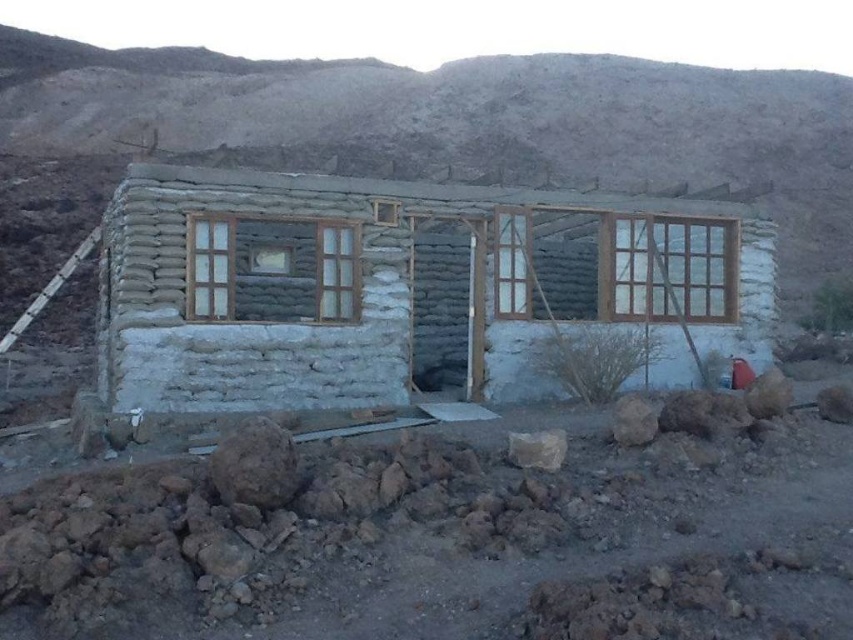
Question: Is wooden-framed glass window at center-right thinner than clear glass door at center?

Choices:
 (A) yes
 (B) no

Answer: (B)

Question: Estimate the real-world distances between objects in this image. Which object is farther from the brown rough rock at lower left?

Choices:
 (A) smooth gray rock at lower center
 (B) gray stone house at center
 (C) wooden-framed glass window at center-right

Answer: (B)

Question: Which point is closer to the camera taking this photo?

Choices:
 (A) (293, 109)
 (B) (531, 460)

Answer: (B)

Question: Does white mud hut at center appear under brown rough rock at lower left?

Choices:
 (A) yes
 (B) no

Answer: (B)

Question: Estimate the real-world distances between objects in this image. Which object is closer to the wooden-framed glass window at center?

Choices:
 (A) wooden-framed glass window at center-right
 (B) brown rough rock at lower left
 (C) gray stone house at center
 (D) white mud hut at center

Answer: (D)

Question: Does gray stone house at center appear under wooden-framed glass window at center?

Choices:
 (A) yes
 (B) no

Answer: (B)